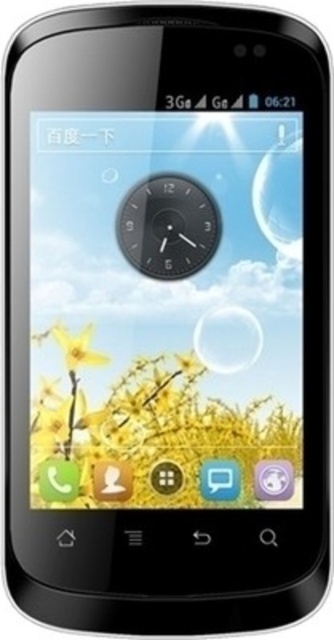
Question: Is black matte clock at center above transparent glass bubble at center?

Choices:
 (A) yes
 (B) no

Answer: (A)

Question: Is black matte clock at center above transparent glass bubble at upper right?

Choices:
 (A) no
 (B) yes

Answer: (A)

Question: Based on their relative distances, which object is nearer to the transparent glass bubble at upper right?

Choices:
 (A) black matte clock at center
 (B) transparent glass bubble at center

Answer: (A)

Question: Does black matte clock at center appear on the right side of transparent glass bubble at center?

Choices:
 (A) no
 (B) yes

Answer: (A)

Question: Which of the following is the closest to the observer?

Choices:
 (A) transparent glass bubble at upper right
 (B) transparent glass bubble at center

Answer: (A)

Question: Which of the following is the closest to the observer?

Choices:
 (A) transparent glass bubble at center
 (B) transparent glass bubble at upper right

Answer: (B)